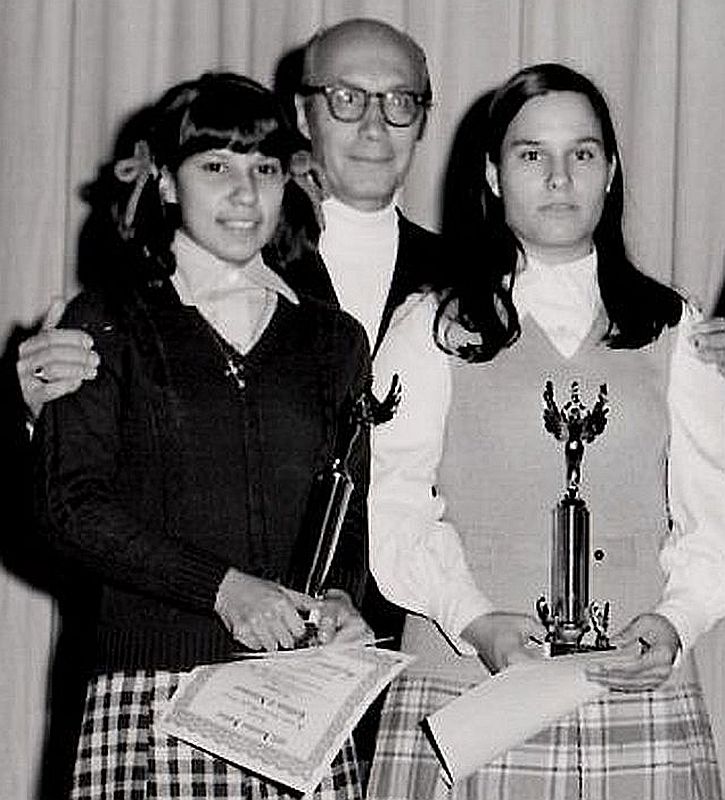
You are a GUI agent. You are given a task and a screenshot of the screen. Output one action in this format:
    pyautogui.click(x=<x>, y=<y>)
    Task: Click on the certificate
    This screenshot has height=800, width=725.
    Given the screenshot: What is the action you would take?
    click(x=306, y=702), click(x=472, y=729)